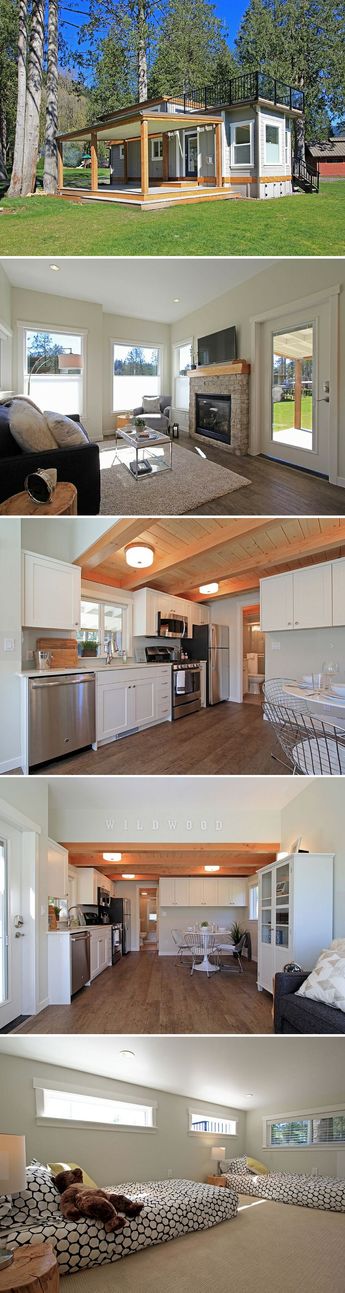
You are a GUI agent. You are given a task and a screenshot of the screen. Output one action in this format:
    pyautogui.click(x=<x>, y=<y>)
    Task: Click on the stainless steel handles
    The width and height of the screenshot is (345, 1293).
    Given the screenshot: What is the action you would take?
    pyautogui.click(x=183, y=631), pyautogui.click(x=215, y=637), pyautogui.click(x=217, y=654), pyautogui.click(x=197, y=666), pyautogui.click(x=80, y=683), pyautogui.click(x=122, y=931), pyautogui.click(x=128, y=908), pyautogui.click(x=129, y=927), pyautogui.click(x=110, y=900), pyautogui.click(x=84, y=935)